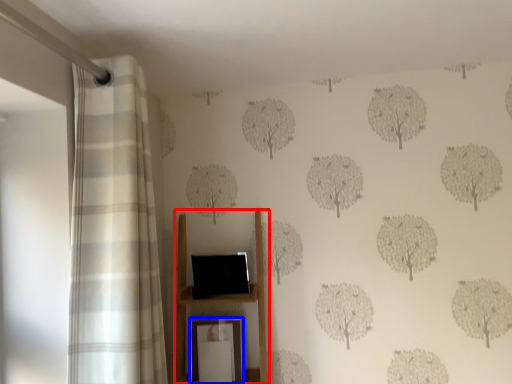
Question: Which of the following is the farthest to the observer, furniture (highlighted by a red box) or picture frame (highlighted by a blue box)?

Choices:
 (A) furniture
 (B) picture frame

Answer: (B)